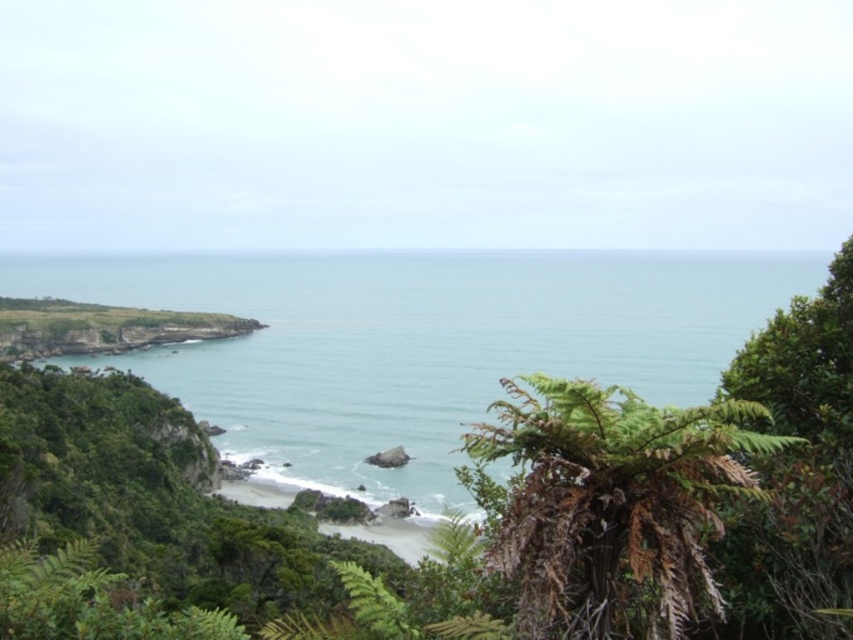
How distant is brown/dried leafy fern at lower right from smooth sand beach at center?

A distance of 13.40 meters exists between brown/dried leafy fern at lower right and smooth sand beach at center.

Does brown/dried leafy fern at lower right have a greater height compared to smooth sand beach at center?

In fact, brown/dried leafy fern at lower right may be shorter than smooth sand beach at center.

Does point (671, 566) lie behind point (260, 488)?

No, it is in front of (260, 488).

Where is `brown/dried leafy fern at lower right`? The width and height of the screenshot is (853, 640). brown/dried leafy fern at lower right is located at coordinates (608, 504).

Is green water at center to the left of smooth sand beach at center from the viewer's perspective?

Incorrect, green water at center is not on the left side of smooth sand beach at center.

From the picture: Who is taller, green water at center or smooth sand beach at center?

green water at center

The width and height of the screenshot is (853, 640). Find the location of `green water at center`. green water at center is located at coordinates (418, 346).

Locate an element on the screen. The height and width of the screenshot is (640, 853). green water at center is located at coordinates pyautogui.click(x=418, y=346).

Between point (718, 257) and point (612, 451), which one is positioned behind?

Positioned behind is point (718, 257).

Is green water at center taller than brown/dried leafy fern at lower right?

Yes, green water at center is taller than brown/dried leafy fern at lower right.

Is point (402, 392) more distant than point (688, 536)?

Yes, it is behind point (688, 536).

At what (x,y) coordinates should I click in order to perform the action: click on green water at center. Please return your answer as a coordinate pair (x, y). This screenshot has width=853, height=640. Looking at the image, I should click on (418, 346).